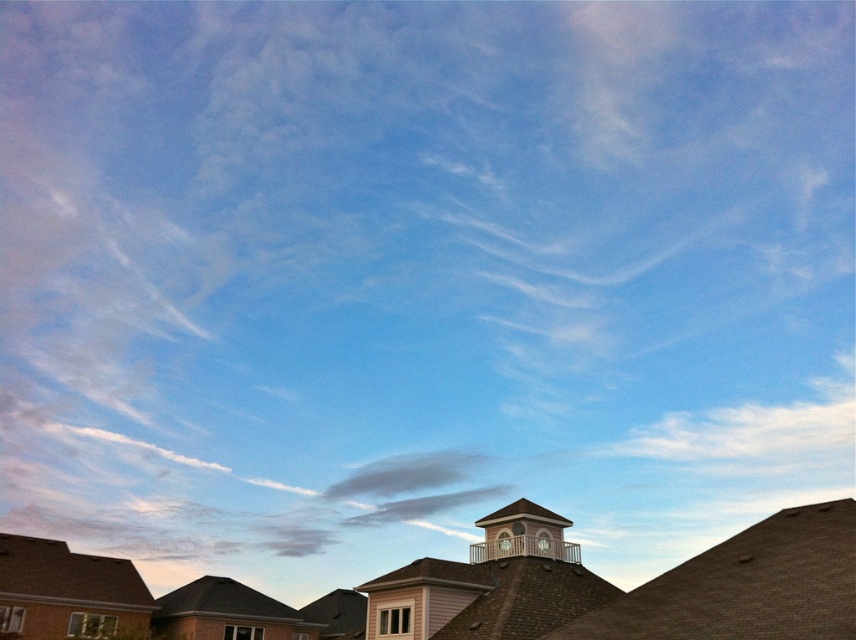
Based on the photo, you are an architect designing a new building and want to ensure that the new structure does not block the view of the matte white clock at upper center from the rooftop of the brown shingles at lower left. Based on the scene, which object is taller and would need to be considered in your design?

The brown shingles at lower left is taller than the matte white clock at upper center, so the new building should be placed in a way that does not obstruct the view from the brown shingles at lower left to the matte white clock at upper center.

You are an architect designing a new rooftop garden. You need to place a new structure on the roof that must be smaller than the existing brown shingles at lower left. Can you confirm if the matte white clock at upper center is a suitable candidate for placement?

The brown shingles at lower left is bigger than the matte white clock at upper center, so the matte white clock at upper center is smaller and can be placed on the roof as it meets the size requirement.

You are an architect designing a new rooftop garden and need to determine the best location for a solar panel. You have two potential points marked on the building plans. The first is at point [670,596] and the second is at point [78,570]. Based on the sky exposure in the image, which point would receive more sunlight throughout the day?

Point [670,596] is in front of point [78,570], so it would receive more sunlight as it is not obstructed by the other point.